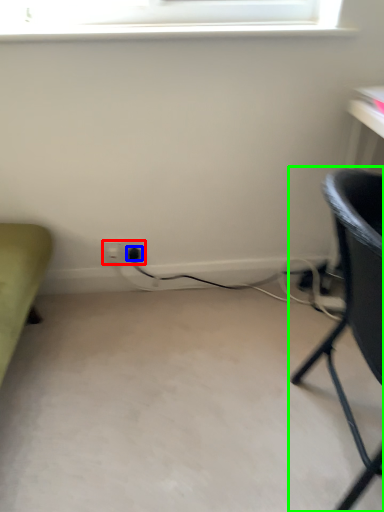
Question: Based on their relative distances, which object is nearer to electric outlet (highlighted by a red box)? Choose from plug (highlighted by a blue box) and chair (highlighted by a green box).

Choices:
 (A) plug
 (B) chair

Answer: (A)